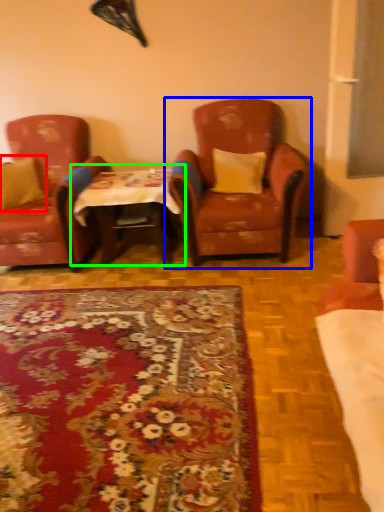
Question: Which object is positioned farthest from pillow (highlighted by a red box)? Select from chair (highlighted by a blue box) and table (highlighted by a green box).

Choices:
 (A) chair
 (B) table

Answer: (A)